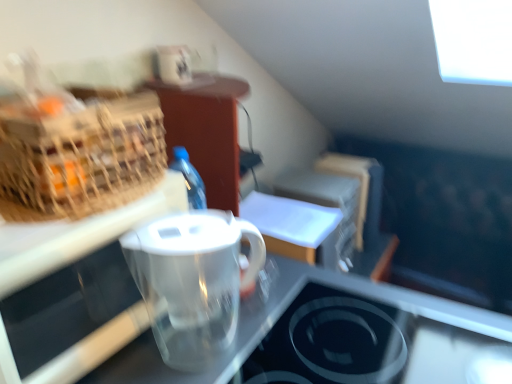
Identify the location of empty space that is ontop of transparent plastic pitcher at center (from a real-world perspective). The image size is (512, 384). (192, 230).